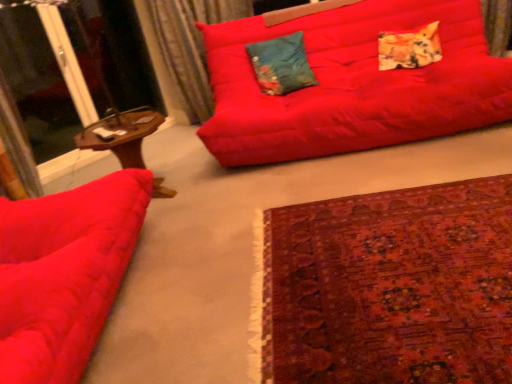
Find the location of `free region on the left part of carpet with intricate patterns at lower right`. free region on the left part of carpet with intricate patterns at lower right is located at coordinates (195, 274).